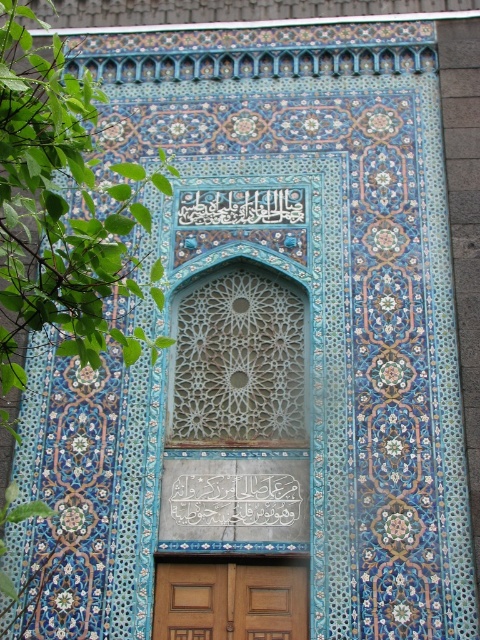
Question: Estimate the real-world distances between objects in this image. Which object is closer to the white calligraphy at center?

Choices:
 (A) white stone writing at center
 (B) wooden panelled door at lower center

Answer: (A)

Question: Can you confirm if white stone writing at center is bigger than white calligraphy at center?

Choices:
 (A) yes
 (B) no

Answer: (A)

Question: Which of the following is the closest to the observer?

Choices:
 (A) (180, 476)
 (B) (168, 611)
 (C) (262, 196)

Answer: (B)

Question: Does wooden panelled door at lower center have a larger size compared to white calligraphy at center?

Choices:
 (A) yes
 (B) no

Answer: (A)

Question: Which object is farther from the camera taking this photo?

Choices:
 (A) white calligraphy at center
 (B) white stone writing at center

Answer: (A)

Question: Can you confirm if white stone writing at center is positioned below white calligraphy at center?

Choices:
 (A) no
 (B) yes

Answer: (B)